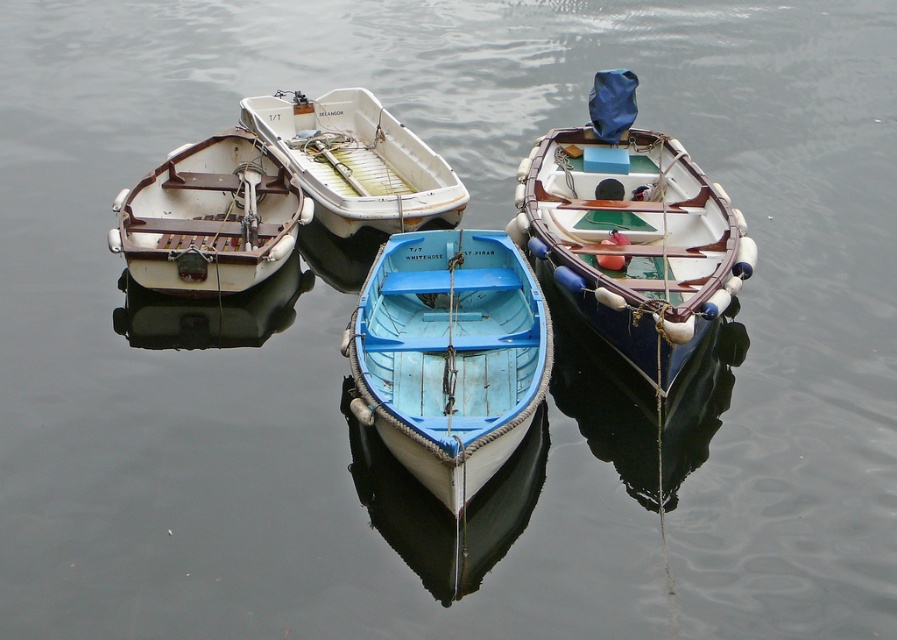
You are standing on the dock and see the wooden boat at center and the white matte boat at upper center on the water. Which boat is closer to you?

The wooden boat at center is closer to you because it is positioned below the white matte boat at upper center, indicating it is nearer in the visual perspective.

You are standing on the dock and want to board the blue matte boat at center and the white matte boat at upper center. Which boat should you approach first to reach the one farther away?

You should approach the blue matte boat at center first because it is closer to you, and then move to the white matte boat at upper center which is farther away.